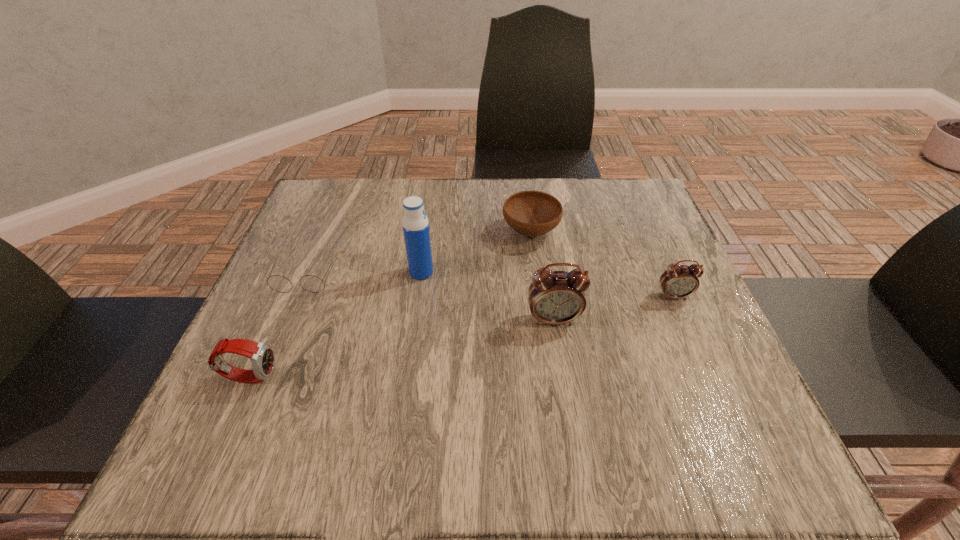
Find the location of `vacant region between the water bottle and the spectacles`. vacant region between the water bottle and the spectacles is located at coordinates (364, 274).

This screenshot has width=960, height=540. Identify the location of free area in between the second nearest object and the spectacles. (430, 297).

Find the location of a particular element. free space between the watch and the farther alarm clock is located at coordinates 462,336.

Where is `object that is the third closest one to the shortest object`? object that is the third closest one to the shortest object is located at coordinates (531, 213).

This screenshot has height=540, width=960. Find the location of `object that can be found as the fifth closest to the fourth object from right to left`. object that can be found as the fifth closest to the fourth object from right to left is located at coordinates (679, 281).

This screenshot has width=960, height=540. In order to click on vacant space that satisfies the following two spatial constraints: 1. on the face of the left alarm clock; 2. on the face of the watch in this screenshot , I will do `click(563, 376)`.

At what (x,y) coordinates should I click in order to perform the action: click on free location that satisfies the following two spatial constraints: 1. on the face of the rightmost object; 2. on the face of the nearest object. Please return your answer as a coordinate pair (x, y). The width and height of the screenshot is (960, 540). Looking at the image, I should click on (708, 376).

What are the coordinates of `vacant space that satisfies the following two spatial constraints: 1. on the face of the right alarm clock; 2. on the face of the nearest object` in the screenshot? It's located at coord(708,376).

Where is `free space that satisfies the following two spatial constraints: 1. on the face of the farther alarm clock; 2. on the face of the watch`? This screenshot has height=540, width=960. free space that satisfies the following two spatial constraints: 1. on the face of the farther alarm clock; 2. on the face of the watch is located at coordinates (708, 376).

The width and height of the screenshot is (960, 540). Identify the location of vacant space that satisfies the following two spatial constraints: 1. on the temples of the spectacles; 2. on the face of the nearest object. (265, 376).